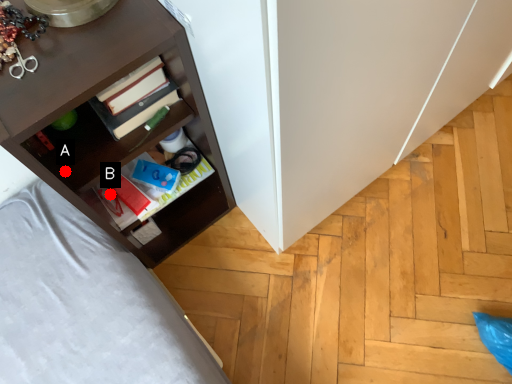
Question: Two points are circled on the image, labeled by A and B beside each circle. Which of the following is the closest to the observer?

Choices:
 (A) A is closer
 (B) B is closer

Answer: (A)